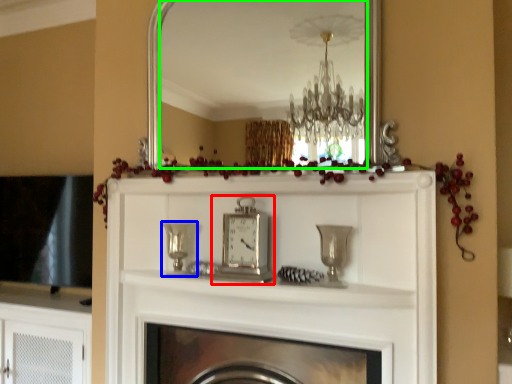
Question: Which object is positioned farthest from clock (highlighted by a red box)? Select from candle holder (highlighted by a blue box) and mirror (highlighted by a green box).

Choices:
 (A) candle holder
 (B) mirror

Answer: (B)